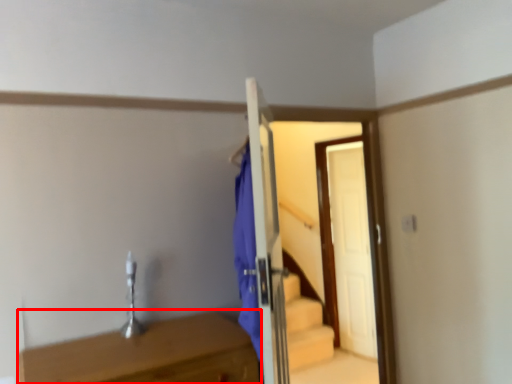
Question: From the image, what is the correct spatial relationship of table (annotated by the red box) in relation to door?

Choices:
 (A) right
 (B) left

Answer: (B)